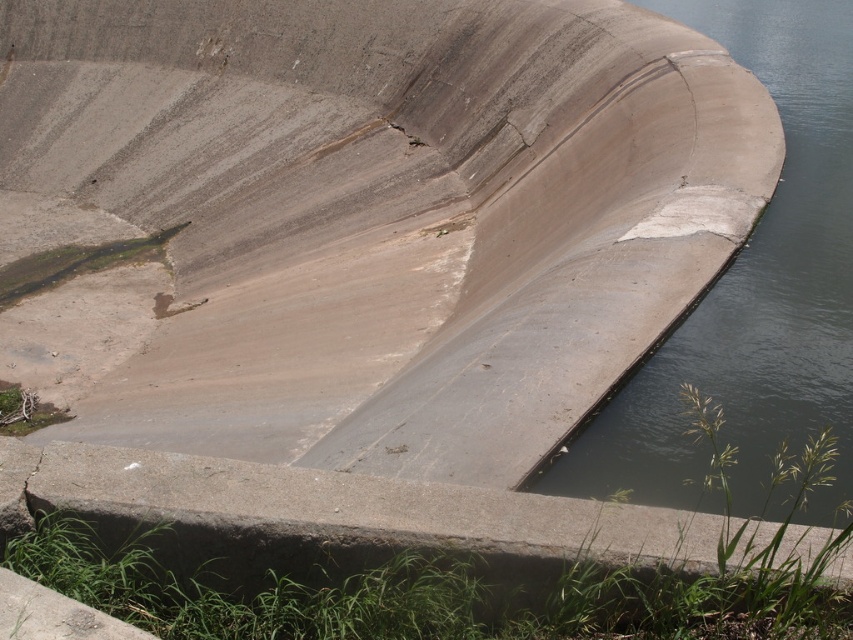
You are standing on the dam and looking towards the water. There are two points marked on the dam surface. The first is at coordinate point (722, 340) and the second is at point (78, 465). Which point is closer to your eyes?

Point (722, 340) is further to the camera than point (78, 465), so the point closer to your eyes is point (78, 465).